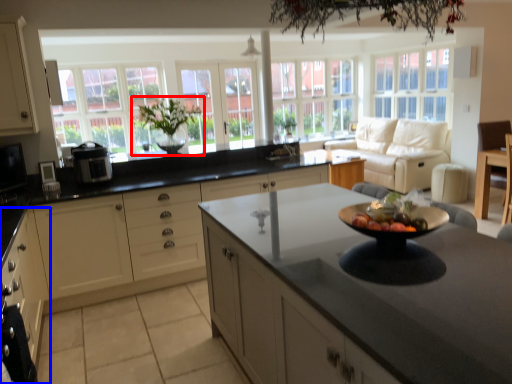
Question: Which point is closer to the camera, houseplant (highlighted by a red box) or cabinetry (highlighted by a blue box)?

Choices:
 (A) houseplant
 (B) cabinetry

Answer: (B)